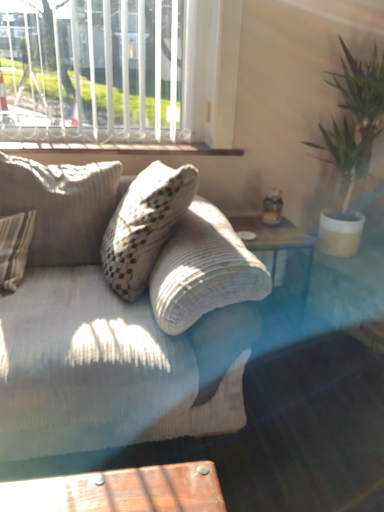
In order to click on vacant space underneath white textured window at upper left (from a real-world perspective) in this screenshot , I will do `click(107, 141)`.